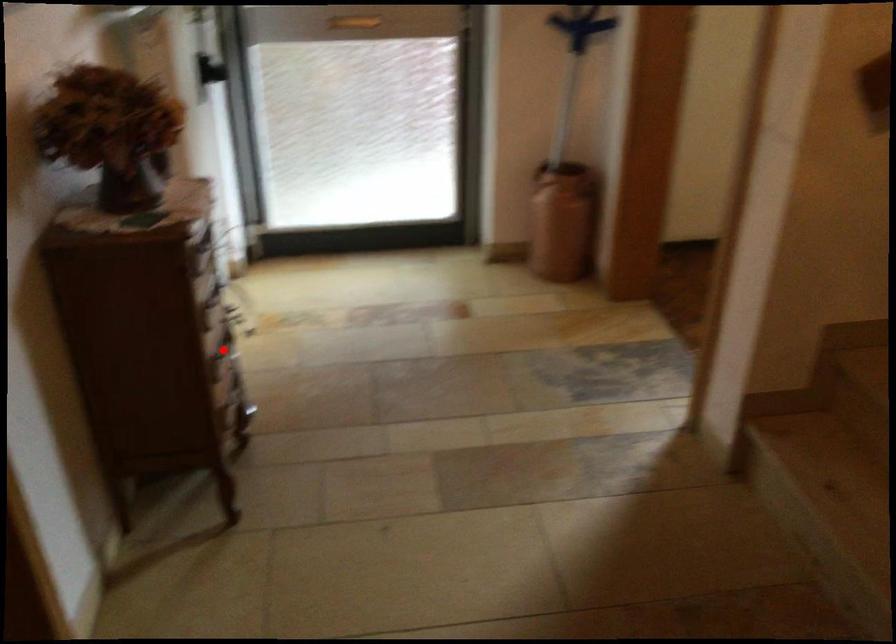
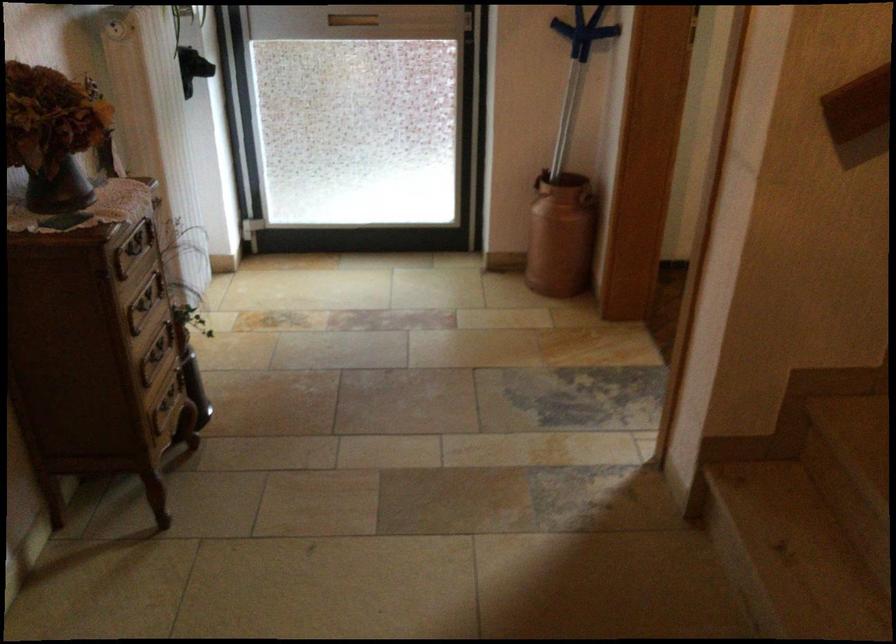
In the second image, find the point that corresponds to the highlighted location in the first image.

(156, 355)